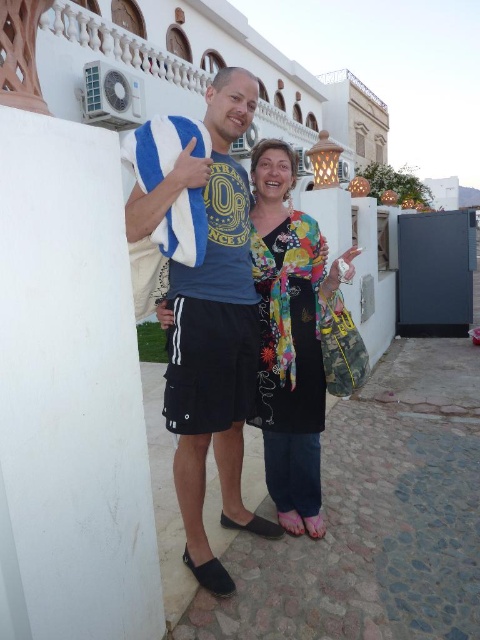
Question: Is blue striped towel at center thinner than floral-patterned fabric at center?

Choices:
 (A) yes
 (B) no

Answer: (B)

Question: Does blue striped towel at center appear on the right side of floral-patterned fabric at center?

Choices:
 (A) no
 (B) yes

Answer: (A)

Question: Which of the following is the farthest from the observer?

Choices:
 (A) blue striped towel at center
 (B) floral-patterned fabric at center

Answer: (B)

Question: Can you confirm if blue striped towel at center is thinner than floral-patterned fabric at center?

Choices:
 (A) no
 (B) yes

Answer: (A)

Question: Among these points, which one is farthest from the camera?

Choices:
 (A) (254, 337)
 (B) (278, 248)

Answer: (B)